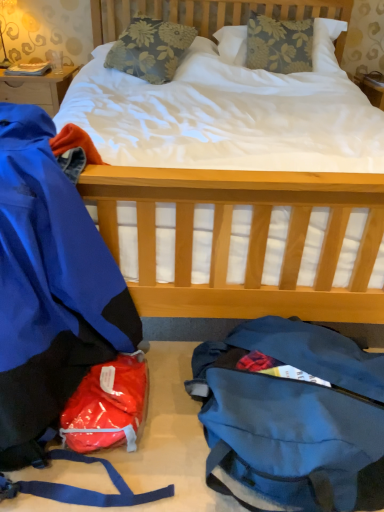
Question: Is there a large distance between blue waterproof jacket at left and floral fabric pillow at upper center, which is the second pillow in left-to-right order?

Choices:
 (A) yes
 (B) no

Answer: (A)

Question: Can you confirm if blue waterproof jacket at left is bigger than floral fabric pillow at upper center, which is the second pillow in left-to-right order?

Choices:
 (A) yes
 (B) no

Answer: (A)

Question: Considering the relative positions of blue waterproof jacket at left and floral fabric pillow at upper center, the first pillow positioned from the right, in the image provided, is blue waterproof jacket at left to the right of floral fabric pillow at upper center, the first pillow positioned from the right, from the viewer's perspective?

Choices:
 (A) yes
 (B) no

Answer: (B)

Question: From a real-world perspective, is blue waterproof jacket at left positioned under floral fabric pillow at upper center, which is the second pillow in left-to-right order, based on gravity?

Choices:
 (A) no
 (B) yes

Answer: (B)

Question: Is blue waterproof jacket at left positioned behind floral fabric pillow at upper center, the first pillow positioned from the right?

Choices:
 (A) no
 (B) yes

Answer: (A)

Question: Considering the relative positions of shiny plastic bag at lower left and matte gold lamp at upper left in the image provided, is shiny plastic bag at lower left to the left or to the right of matte gold lamp at upper left?

Choices:
 (A) left
 (B) right

Answer: (B)

Question: From a real-world perspective, is shiny plastic bag at lower left positioned above or below matte gold lamp at upper left?

Choices:
 (A) below
 (B) above

Answer: (A)

Question: In the image, is shiny plastic bag at lower left positioned in front of or behind matte gold lamp at upper left?

Choices:
 (A) behind
 (B) front

Answer: (B)

Question: From the image's perspective, is shiny plastic bag at lower left positioned above or below matte gold lamp at upper left?

Choices:
 (A) above
 (B) below

Answer: (B)

Question: Is matte gold lamp at upper left inside or outside of hardcover book at upper left?

Choices:
 (A) inside
 (B) outside

Answer: (B)

Question: Is point (0, 34) positioned closer to the camera than point (29, 74)?

Choices:
 (A) farther
 (B) closer

Answer: (A)

Question: In terms of size, does matte gold lamp at upper left appear bigger or smaller than hardcover book at upper left?

Choices:
 (A) small
 (B) big

Answer: (B)

Question: In terms of height, does matte gold lamp at upper left look taller or shorter compared to hardcover book at upper left?

Choices:
 (A) tall
 (B) short

Answer: (A)

Question: From the image's perspective, is hardcover book at upper left located above or below blue waterproof jacket at left?

Choices:
 (A) below
 (B) above

Answer: (B)

Question: Visually, is hardcover book at upper left positioned to the left or to the right of blue waterproof jacket at left?

Choices:
 (A) left
 (B) right

Answer: (A)